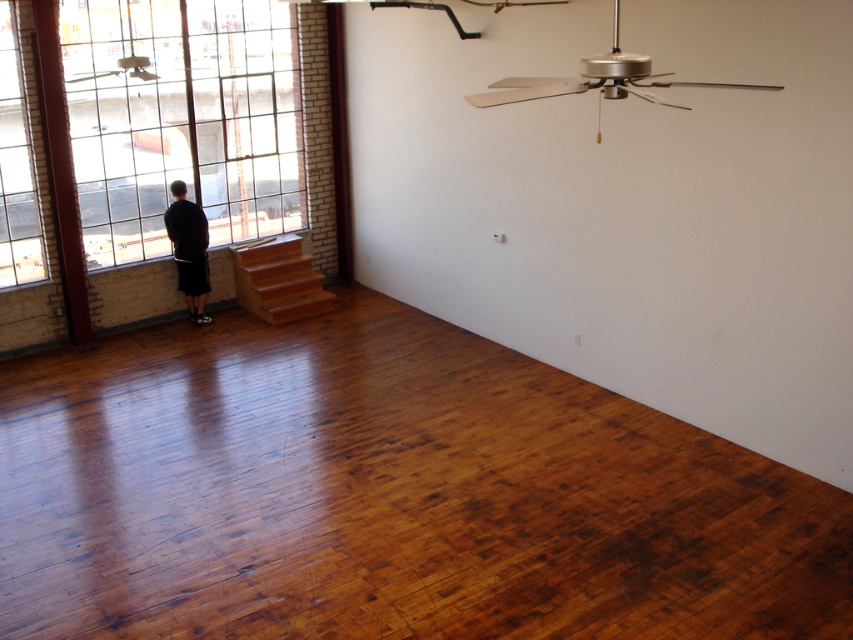
Who is more forward, (675,630) or (16,204)?

Positioned in front is point (675,630).

Who is more distant from viewer, (x=467, y=497) or (x=0, y=202)?

Positioned behind is point (x=0, y=202).

Locate an element on the screen. The width and height of the screenshot is (853, 640). shiny brown hardwood floor at center is located at coordinates (386, 493).

Which is in front, point (219, 40) or point (195, 305)?

Point (195, 305) is more forward.

Which is behind, point (91, 198) or point (178, 237)?

The point (91, 198) is behind.

Describe the element at coordinates (183, 120) in the screenshot. This screenshot has width=853, height=640. I see `clear glass window at upper left` at that location.

The height and width of the screenshot is (640, 853). I want to click on clear glass window at upper left, so click(x=183, y=120).

Who is shorter, shiny brown hardwood floor at center or black matte shorts at left?

With less height is shiny brown hardwood floor at center.

This screenshot has height=640, width=853. What are the coordinates of `shiny brown hardwood floor at center` in the screenshot? It's located at (386, 493).

The height and width of the screenshot is (640, 853). What do you see at coordinates (386, 493) in the screenshot? I see `shiny brown hardwood floor at center` at bounding box center [386, 493].

Where is `shiny brown hardwood floor at center`? This screenshot has height=640, width=853. shiny brown hardwood floor at center is located at coordinates (386, 493).